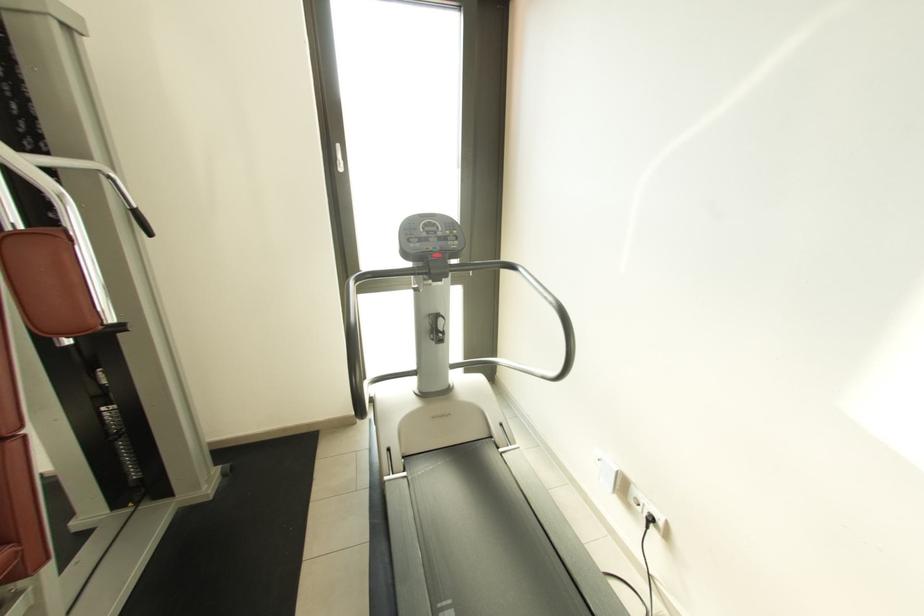
Describe the element at coordinates (475, 554) in the screenshot. The width and height of the screenshot is (924, 616). I see `the machine safety rail` at that location.